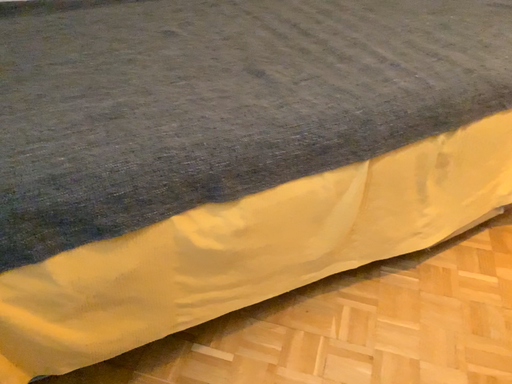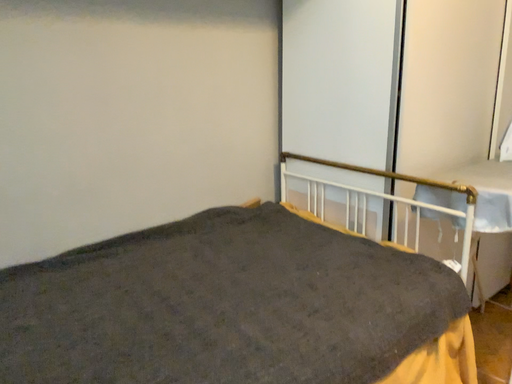
Question: How did the camera likely rotate when shooting the video?

Choices:
 (A) rotated right
 (B) rotated left

Answer: (A)